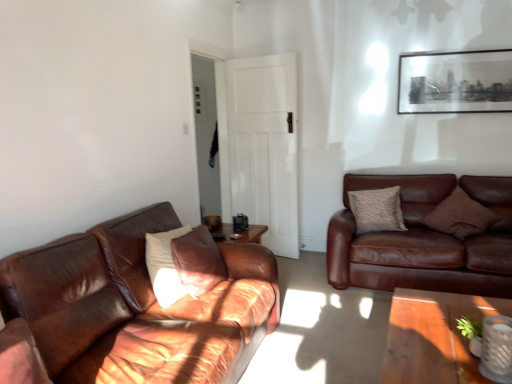
Where is `blank space situated above black matte picture frame at upper right (from a real-world perspective)`? The height and width of the screenshot is (384, 512). blank space situated above black matte picture frame at upper right (from a real-world perspective) is located at coordinates (459, 56).